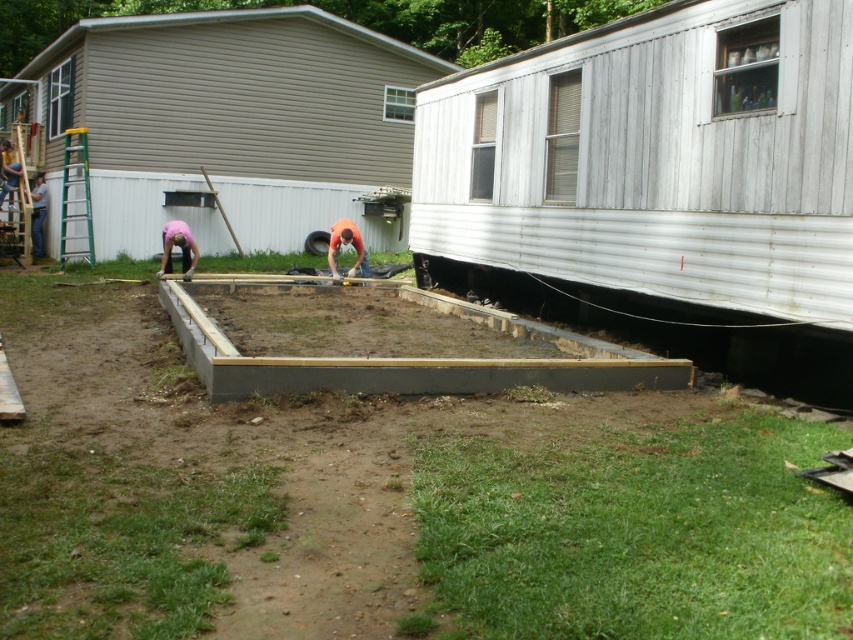
Question: Does pink fabric at center have a greater width compared to orange fabric construction worker at center?

Choices:
 (A) yes
 (B) no

Answer: (A)

Question: Is brown wooden frame at center smaller than beige siding shed at upper left?

Choices:
 (A) no
 (B) yes

Answer: (B)

Question: Which object appears closest to the camera in this image?

Choices:
 (A) gray concrete foundation at center
 (B) beige siding shed at upper left

Answer: (A)

Question: Can you confirm if gray concrete foundation at center is thinner than orange fabric construction worker at center?

Choices:
 (A) yes
 (B) no

Answer: (A)

Question: Which of the following is the closest to the observer?

Choices:
 (A) beige siding shed at upper left
 (B) brown wooden frame at center
 (C) pink fabric at center

Answer: (B)

Question: Which point appears farthest from the camera in this image?

Choices:
 (A) (343, 220)
 (B) (194, 262)
 (C) (97, 454)

Answer: (A)